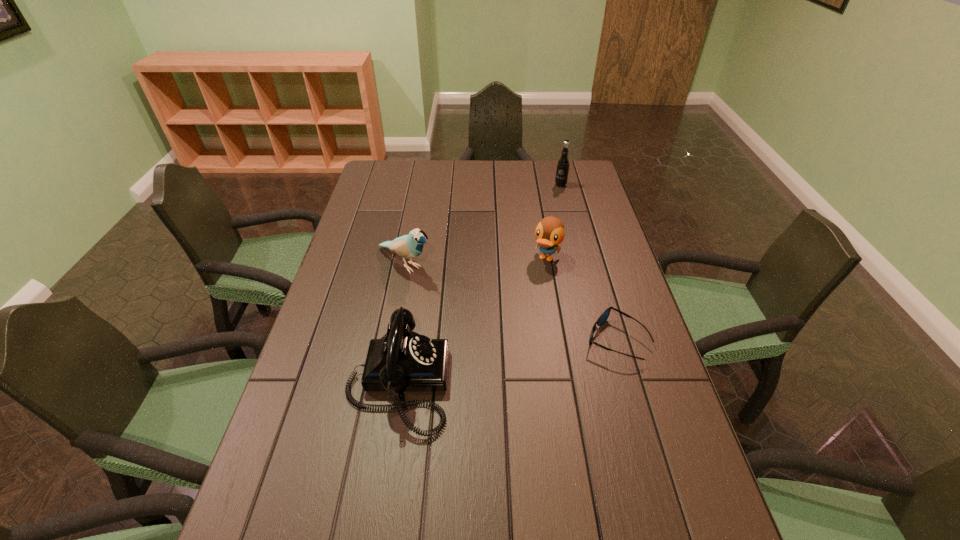
Image resolution: width=960 pixels, height=540 pixels. Identify the location of free spot on the desktop that is between the telephone and the shortest object and is positioned at the face of the bird. (542, 354).

Find the location of a particular element. This screenshot has height=540, width=960. free spot on the desktop that is between the telephone and the shortest object and is positioned on the front-facing side of the third object from right to left is located at coordinates 490,364.

Where is `free space on the desktop that is between the telephone and the sunglasses and is positioned on the label of the root beer`? This screenshot has height=540, width=960. free space on the desktop that is between the telephone and the sunglasses and is positioned on the label of the root beer is located at coordinates (505, 362).